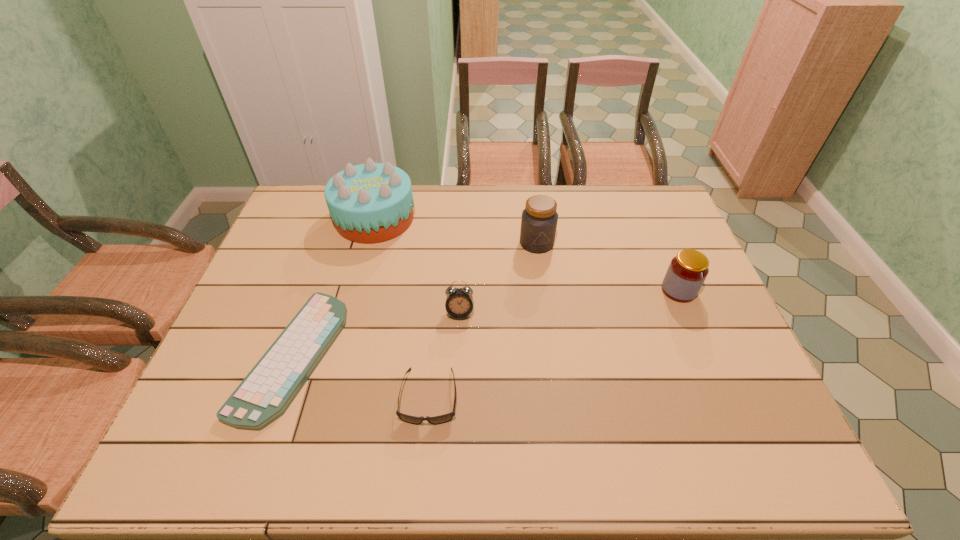
Locate an element on the screen. This screenshot has width=960, height=540. free spot between the computer keyboard and the second object from right to left is located at coordinates (415, 300).

Image resolution: width=960 pixels, height=540 pixels. I want to click on vacant space in between the farther jar and the third tallest object, so click(x=608, y=267).

I want to click on free spot between the rightmost object and the computer keyboard, so click(486, 323).

The height and width of the screenshot is (540, 960). Identify the location of empty location between the second shortest object and the taller jar. (483, 320).

Image resolution: width=960 pixels, height=540 pixels. In order to click on free area in between the second object from right to left and the sunglasses in this screenshot , I will do `click(483, 320)`.

You are a GUI agent. You are given a task and a screenshot of the screen. Output one action in this format:
    pyautogui.click(x=<x>, y=<y>)
    Task: Click on the free area in between the fourth tallest object and the right jar
    Image resolution: width=960 pixels, height=540 pixels.
    Given the screenshot: What is the action you would take?
    pyautogui.click(x=569, y=301)

The image size is (960, 540). I want to click on object that is the fourth nearest to the farther jar, so click(x=441, y=419).

Where is `object that is the second closest to the second shortest object`? This screenshot has height=540, width=960. object that is the second closest to the second shortest object is located at coordinates (265, 394).

Identify the location of free spot that satisfies the following two spatial constraints: 1. on the surface of the shorter jar near the warning symbol; 2. on the right side of the second object from right to left. (543, 291).

At what (x,y) coordinates should I click in order to perform the action: click on free space in the image that satisfies the following two spatial constraints: 1. on the surface of the rightmost object near the warning symbol; 2. on the left side of the taller jar. Please return your answer as a coordinate pair (x, y). Image resolution: width=960 pixels, height=540 pixels. Looking at the image, I should click on (543, 291).